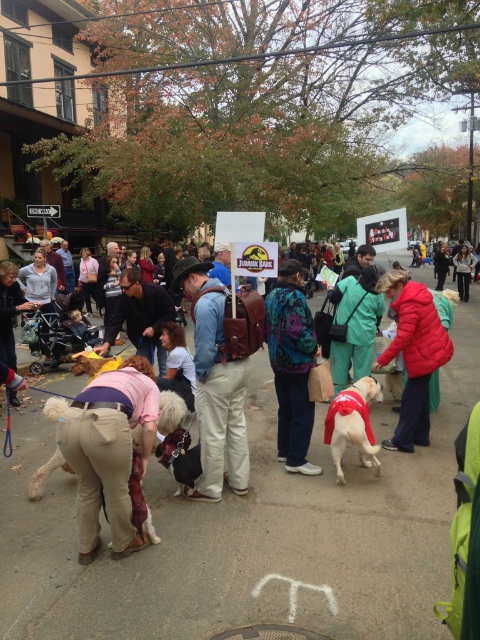
Does denim jacket at center have a larger size compared to shiny red fabric dog at center?

Yes.

Between point (156, 339) and point (347, 400), which one is positioned behind?

The point (156, 339) is behind.

Image resolution: width=480 pixels, height=640 pixels. I want to click on denim jacket at center, so click(140, 316).

Does leather backpack at center have a larger size compared to white fluffy dog at lower left?

Yes, leather backpack at center is bigger than white fluffy dog at lower left.

The height and width of the screenshot is (640, 480). What do you see at coordinates (215, 385) in the screenshot? I see `leather backpack at center` at bounding box center [215, 385].

Identify the location of leather backpack at center. (215, 385).

Where is `leather backpack at center`? The image size is (480, 640). leather backpack at center is located at coordinates (215, 385).

Who is positioned more to the right, matte red jacket at center or fluffy beige dog at center?

matte red jacket at center

What do you see at coordinates (412, 355) in the screenshot? I see `matte red jacket at center` at bounding box center [412, 355].

The image size is (480, 640). Find the location of `matte red jacket at center`. matte red jacket at center is located at coordinates (412, 355).